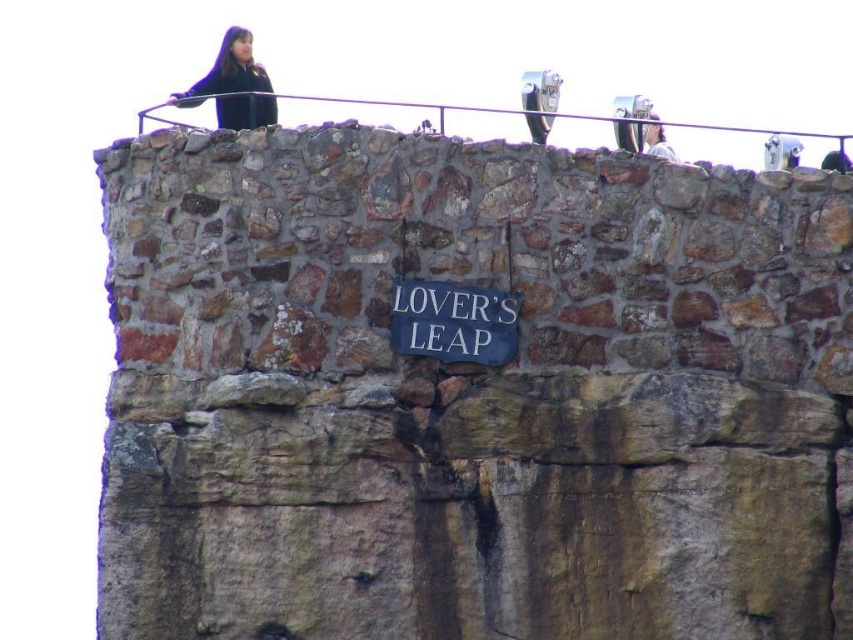
You are planning to install a new sign next to the existing white painted wood sign at center and light brown hair at upper right. Considering their sizes, which object should you place closer to the edge of the structure to ensure visibility?

The white painted wood sign at center should be placed closer to the edge because its width is larger than the light brown hair at upper right, making it more visible from a distance.

You are standing at the viewing platform and want to read the white painted wood sign at center. However, the matte black jacket at upper left is blocking your view. Which object is taller, making it harder to see the sign?

The matte black jacket at upper left is taller than the white painted wood sign at center, so it is blocking the view of the sign.